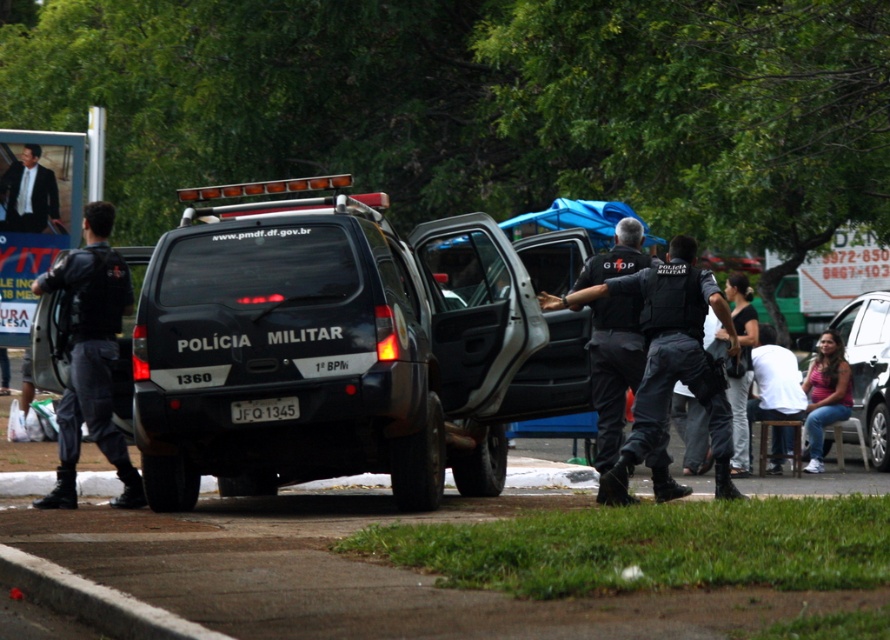
Question: Which object appears closest to the camera in this image?

Choices:
 (A) pink fabric shirt at lower right
 (B) black plastic license plate at center
 (C) matte black uniform at left

Answer: (B)

Question: Which of the following is the closest to the observer?

Choices:
 (A) matte black uniform at left
 (B) matte black vehicle at center
 (C) black plastic license plate at center

Answer: (B)

Question: Is matte black vehicle at center thinner than white concrete curb at lower left?

Choices:
 (A) yes
 (B) no

Answer: (B)

Question: Does black matte uniform at center appear over white matte car at lower right?

Choices:
 (A) no
 (B) yes

Answer: (B)

Question: Is matte black vehicle at center closer to camera compared to matte black uniform at left?

Choices:
 (A) no
 (B) yes

Answer: (B)

Question: Based on their relative distances, which object is farther from the white matte car at lower right?

Choices:
 (A) black matte uniform at center
 (B) matte black vehicle at center

Answer: (B)